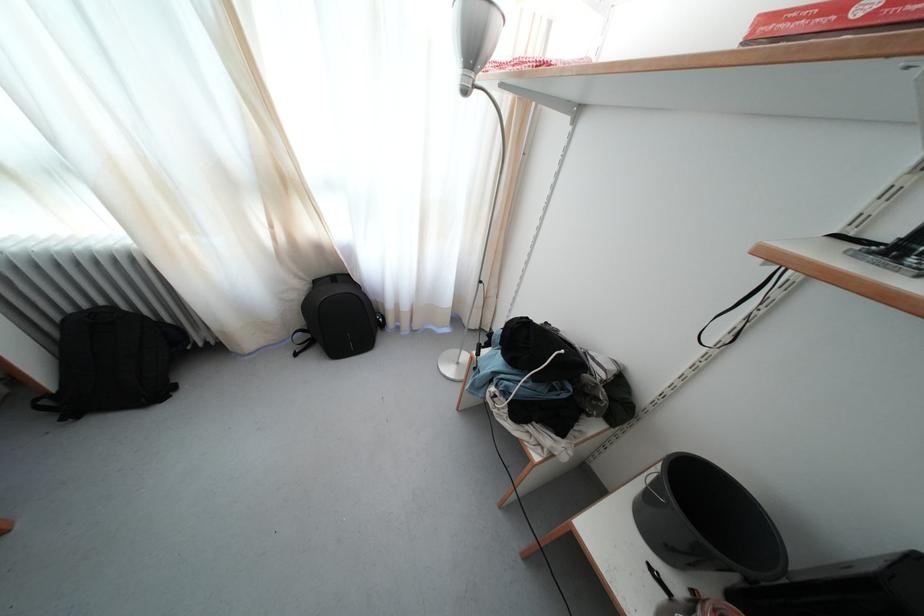
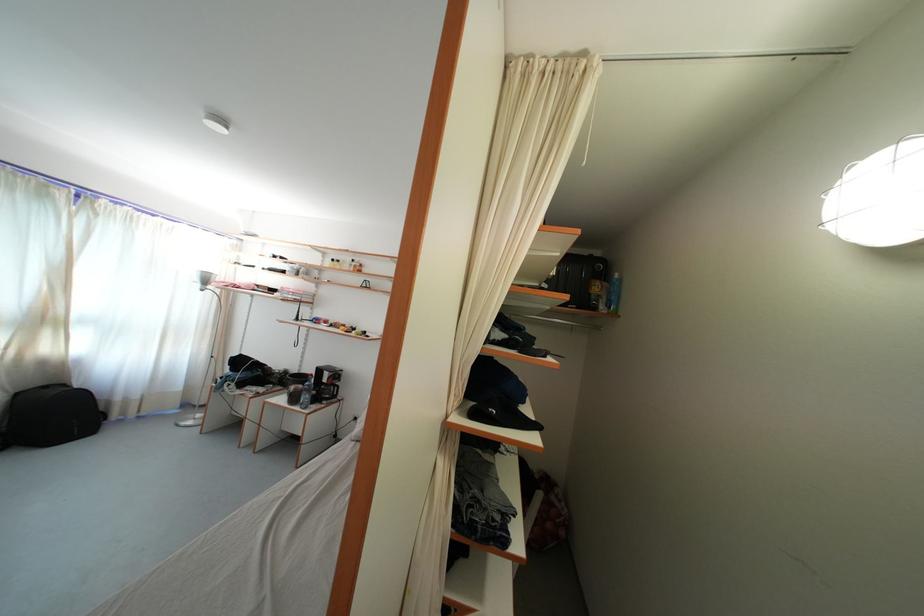
Locate, in the second image, the point that corresponds to (288,188) in the first image.

(52, 326)